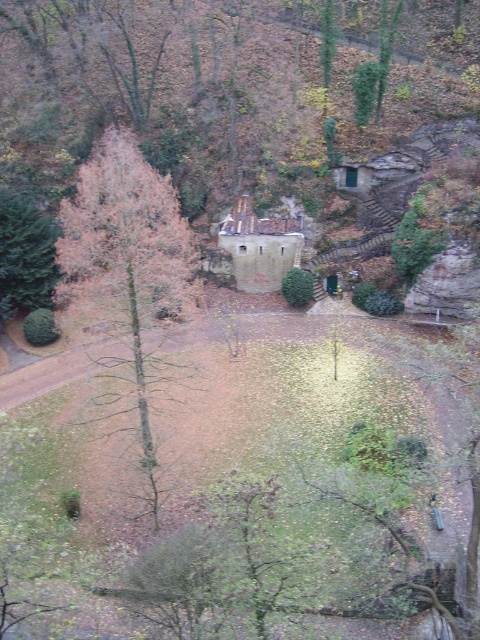
Is brown leafy tree at left further to camera compared to green leafy tree at upper center?

No, brown leafy tree at left is in front of green leafy tree at upper center.

Who is more distant from viewer, (86, 221) or (373, 93)?

Point (373, 93)

Identify the location of brown leafy tree at left. This screenshot has width=480, height=640. (129, 252).

Is point (406, 218) positioned after point (355, 113)?

No, (406, 218) is in front of (355, 113).

Can you confirm if green leafy bush at center right is positioned to the right of green leafy tree at upper center?

Indeed, green leafy bush at center right is positioned on the right side of green leafy tree at upper center.

This screenshot has width=480, height=640. Describe the element at coordinates (416, 241) in the screenshot. I see `green leafy bush at center right` at that location.

The width and height of the screenshot is (480, 640). What are the coordinates of `green leafy bush at center right` in the screenshot? It's located at (416, 241).

Locate an element on the screen. The width and height of the screenshot is (480, 640). brown stone castle at center is located at coordinates (222, 84).

Does brown stone castle at center have a greater height compared to brown leafy tree at left?

In fact, brown stone castle at center may be shorter than brown leafy tree at left.

Which is behind, point (109, 80) or point (131, 284)?

The point (109, 80) is behind.

Image resolution: width=480 pixels, height=640 pixels. Identify the location of brown stone castle at center. (222, 84).